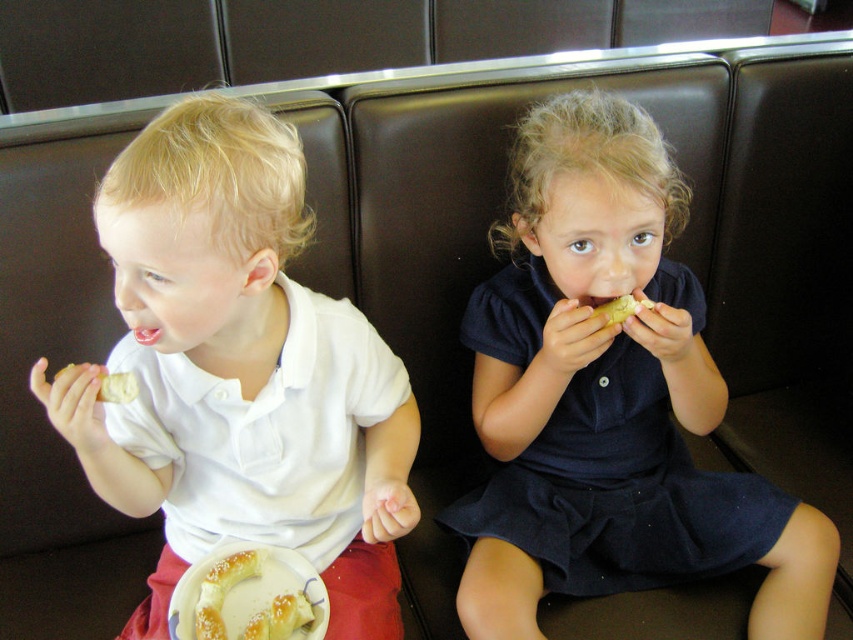
You are a waiter in a restaurant and need to serve two customers. The customers are sitting at a booth with a golden brown pastry at lower left and a yellow matte pastry at upper center. Which pastry is taller?

The golden brown pastry at lower left is taller than the yellow matte pastry at upper center.